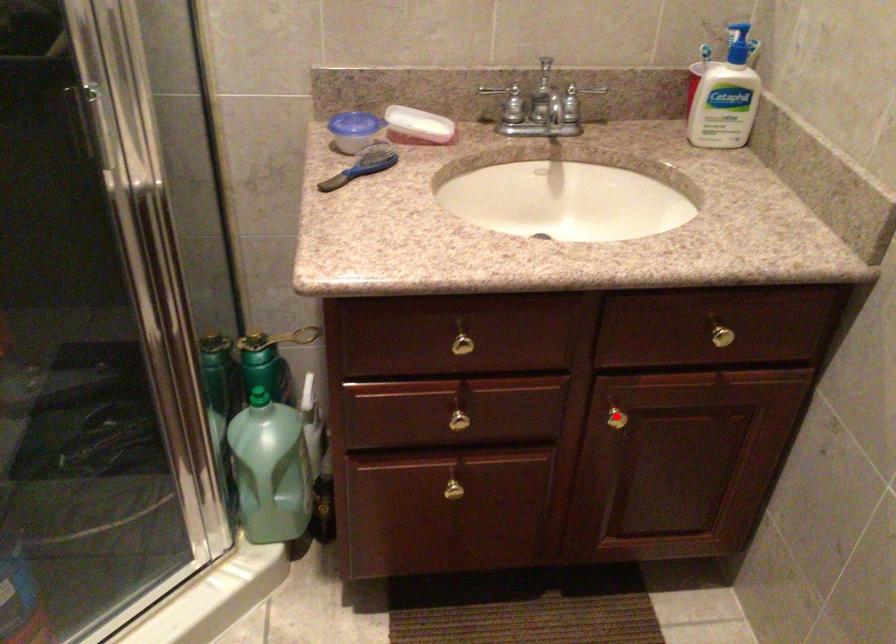
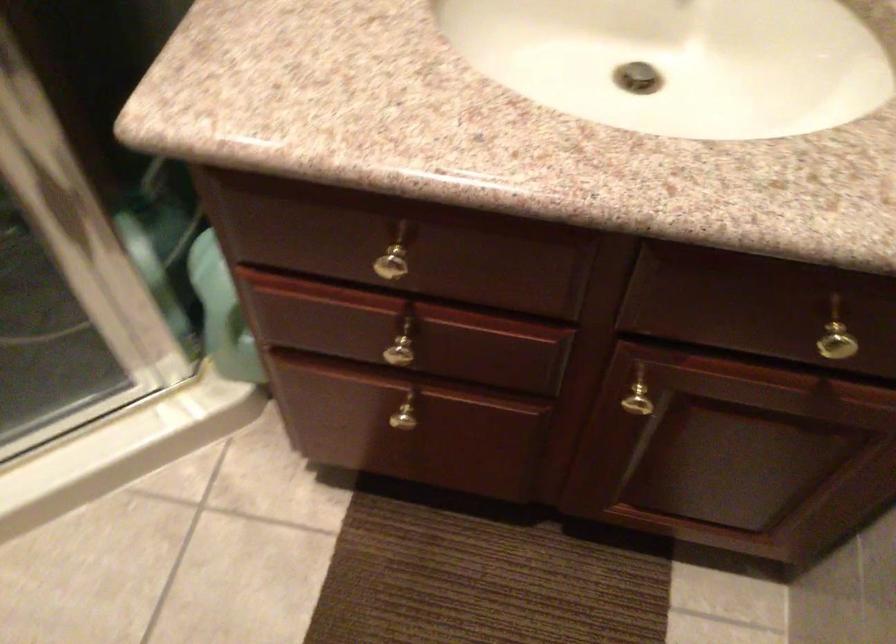
Find the pixel in the second image that matches the highlighted location in the first image.

(640, 399)